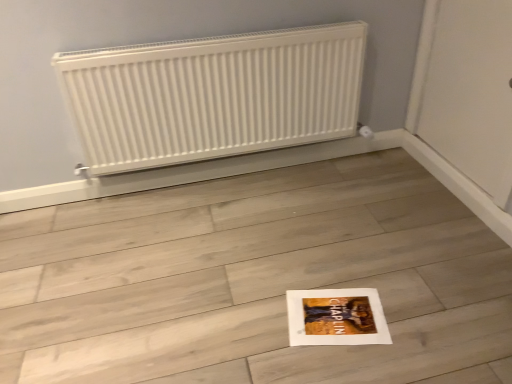
Question: Considering the positions of point (323, 64) and point (186, 331), is point (323, 64) closer or farther from the camera than point (186, 331)?

Choices:
 (A) closer
 (B) farther

Answer: (B)

Question: Is white matte radiator at upper center inside the boundaries of white paper at center, or outside?

Choices:
 (A) outside
 (B) inside

Answer: (A)

Question: Considering the relative positions of white matte radiator at upper center and white paper at center in the image provided, is white matte radiator at upper center to the left or to the right of white paper at center?

Choices:
 (A) left
 (B) right

Answer: (A)

Question: Considering the positions of point (18, 238) and point (357, 59), is point (18, 238) closer or farther from the camera than point (357, 59)?

Choices:
 (A) farther
 (B) closer

Answer: (B)

Question: Visually, is white paper at center positioned to the left or to the right of white matte radiator at upper center?

Choices:
 (A) right
 (B) left

Answer: (A)

Question: From a real-world perspective, is white paper at center positioned above or below white matte radiator at upper center?

Choices:
 (A) above
 (B) below

Answer: (B)

Question: In terms of width, does white paper at center look wider or thinner when compared to white matte radiator at upper center?

Choices:
 (A) wide
 (B) thin

Answer: (A)